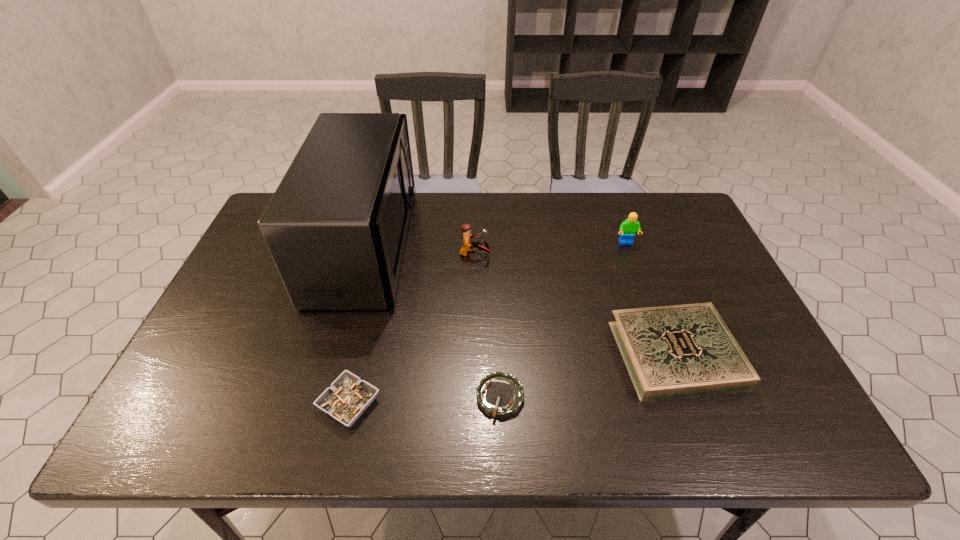
This screenshot has height=540, width=960. What are the coordinates of `the tallest object` in the screenshot? It's located at (336, 226).

Locate an element on the screen. the right Lego is located at coordinates (628, 228).

Image resolution: width=960 pixels, height=540 pixels. In order to click on the left Lego in this screenshot , I will do `click(467, 246)`.

Identify the location of hardback book. The width and height of the screenshot is (960, 540). (678, 351).

This screenshot has height=540, width=960. In order to click on the second shortest object in this screenshot , I will do `click(346, 399)`.

What are the coordinates of `the left ashtray` in the screenshot? It's located at (346, 399).

Image resolution: width=960 pixels, height=540 pixels. Find the location of `the right ashtray`. the right ashtray is located at coordinates (500, 395).

Identify the location of the shorter ashtray. (500, 395).

I want to click on vacant space situated 0.310m on the front-facing side of the microwave_oven, so click(513, 245).

Image resolution: width=960 pixels, height=540 pixels. What are the coordinates of `free location located on the face of the right Lego` in the screenshot? It's located at (632, 258).